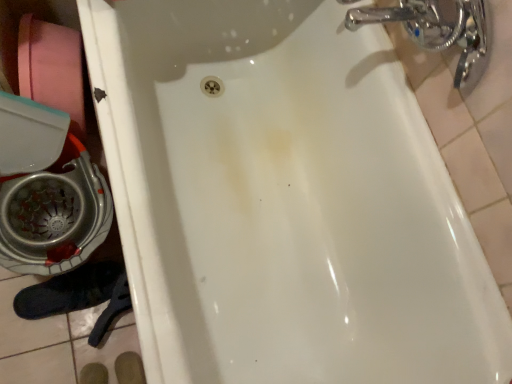
Question: Should I look upward or downward to see black suede shoe at lower left?

Choices:
 (A) down
 (B) up

Answer: (A)

Question: Is chrome metallic faucet at upper right looking in the opposite direction of black suede shoe at lower left?

Choices:
 (A) no
 (B) yes

Answer: (A)

Question: Considering the relative sizes of chrome metallic faucet at upper right and black suede shoe at lower left in the image provided, is chrome metallic faucet at upper right shorter than black suede shoe at lower left?

Choices:
 (A) no
 (B) yes

Answer: (A)

Question: Are chrome metallic faucet at upper right and black suede shoe at lower left located far from each other?

Choices:
 (A) no
 (B) yes

Answer: (A)

Question: Does chrome metallic faucet at upper right turn towards black suede shoe at lower left?

Choices:
 (A) no
 (B) yes

Answer: (A)

Question: Can you confirm if chrome metallic faucet at upper right is positioned to the left of black suede shoe at lower left?

Choices:
 (A) no
 (B) yes

Answer: (A)

Question: Can you confirm if chrome metallic faucet at upper right is positioned to the right of black suede shoe at lower left?

Choices:
 (A) no
 (B) yes

Answer: (B)

Question: Is black suede shoe at lower left oriented away from pink cardboard toilet paper at left?

Choices:
 (A) no
 (B) yes

Answer: (A)

Question: Does black suede shoe at lower left come behind pink cardboard toilet paper at left?

Choices:
 (A) yes
 (B) no

Answer: (A)

Question: Is black suede shoe at lower left at the right side of pink cardboard toilet paper at left?

Choices:
 (A) no
 (B) yes

Answer: (B)

Question: From the image's perspective, is black suede shoe at lower left located beneath pink cardboard toilet paper at left?

Choices:
 (A) yes
 (B) no

Answer: (A)

Question: Considering the relative sizes of black suede shoe at lower left and pink cardboard toilet paper at left in the image provided, is black suede shoe at lower left shorter than pink cardboard toilet paper at left?

Choices:
 (A) yes
 (B) no

Answer: (A)

Question: Does black suede shoe at lower left have a greater height compared to pink cardboard toilet paper at left?

Choices:
 (A) no
 (B) yes

Answer: (A)

Question: Is pink cardboard toilet paper at left wider than chrome metallic faucet at upper right?

Choices:
 (A) yes
 (B) no

Answer: (B)